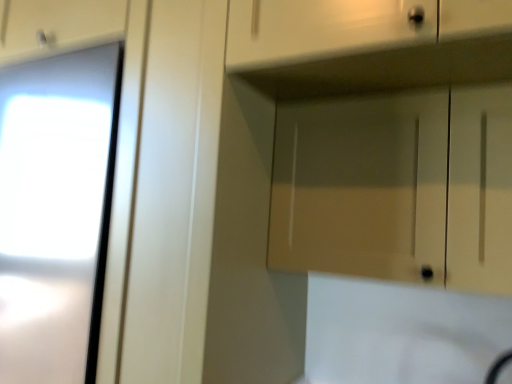
Question: From their relative heights in the image, would you say matte wood cabinet at upper center is taller or shorter than matte white drawer at upper right?

Choices:
 (A) short
 (B) tall

Answer: (B)

Question: Looking at their shapes, would you say matte wood cabinet at upper center is wider or thinner than matte white drawer at upper right?

Choices:
 (A) wide
 (B) thin

Answer: (B)

Question: From a real-world perspective, is matte wood cabinet at upper center physically located above or below matte white drawer at upper right?

Choices:
 (A) above
 (B) below

Answer: (B)

Question: From a real-world perspective, is matte white drawer at upper right positioned above or below matte wood cabinet at upper center?

Choices:
 (A) above
 (B) below

Answer: (A)

Question: Is point (419, 38) closer or farther from the camera than point (288, 125)?

Choices:
 (A) closer
 (B) farther

Answer: (A)

Question: From the image's perspective, relative to matte wood cabinet at upper center, is matte white drawer at upper right above or below?

Choices:
 (A) below
 (B) above

Answer: (B)

Question: Visually, is matte white drawer at upper right positioned to the left or to the right of matte wood cabinet at upper center?

Choices:
 (A) right
 (B) left

Answer: (B)